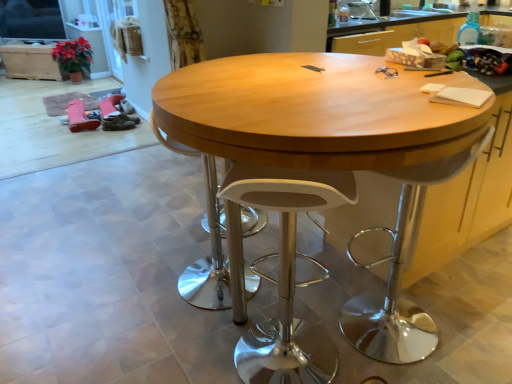
I want to click on free space to the left of white plastic stool at center, so click(x=196, y=347).